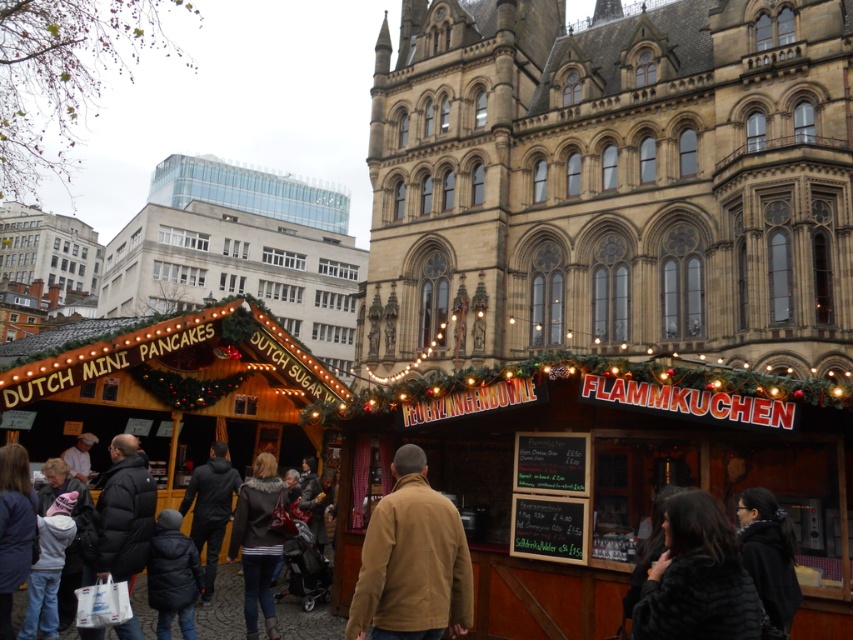
Question: Which of the following is the farthest from the observer?

Choices:
 (A) (225, 634)
 (B) (660, 611)
 (C) (393, 506)

Answer: (A)

Question: Among these points, which one is farthest from the camera?

Choices:
 (A) (444, 516)
 (B) (213, 634)
 (C) (751, 588)

Answer: (B)

Question: Can you confirm if black fur coat at lower right is smaller than dark brown leather jacket at lower center?

Choices:
 (A) yes
 (B) no

Answer: (A)

Question: Which of the following is the closest to the observer?

Choices:
 (A) (312, 634)
 (B) (378, 632)

Answer: (B)

Question: Is tan softshell jacket at center thinner than black fur coat at lower right?

Choices:
 (A) no
 (B) yes

Answer: (A)

Question: Can you confirm if tan softshell jacket at center is positioned below dark brown leather jacket at lower center?

Choices:
 (A) no
 (B) yes

Answer: (A)